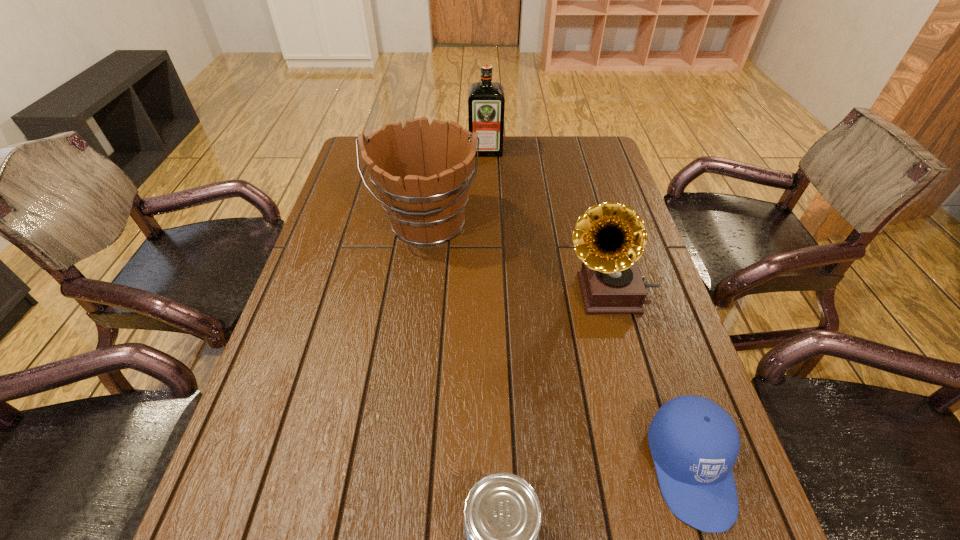
Where is `free space between the cap and the fourth nearest object`? Image resolution: width=960 pixels, height=540 pixels. free space between the cap and the fourth nearest object is located at coordinates (559, 346).

Image resolution: width=960 pixels, height=540 pixels. I want to click on vacant space that's between the cap and the wine bucket, so click(559, 346).

Where is `object that is the fourth closest to the liquor`? object that is the fourth closest to the liquor is located at coordinates (503, 516).

Identify which object is the second closest to the wine bucket. Please provide its 2D coordinates. Your answer should be formatted as a tuple, i.e. [(x, y)], where the tuple contains the x and y coordinates of a point satisfying the conditions above.

[(486, 102)]